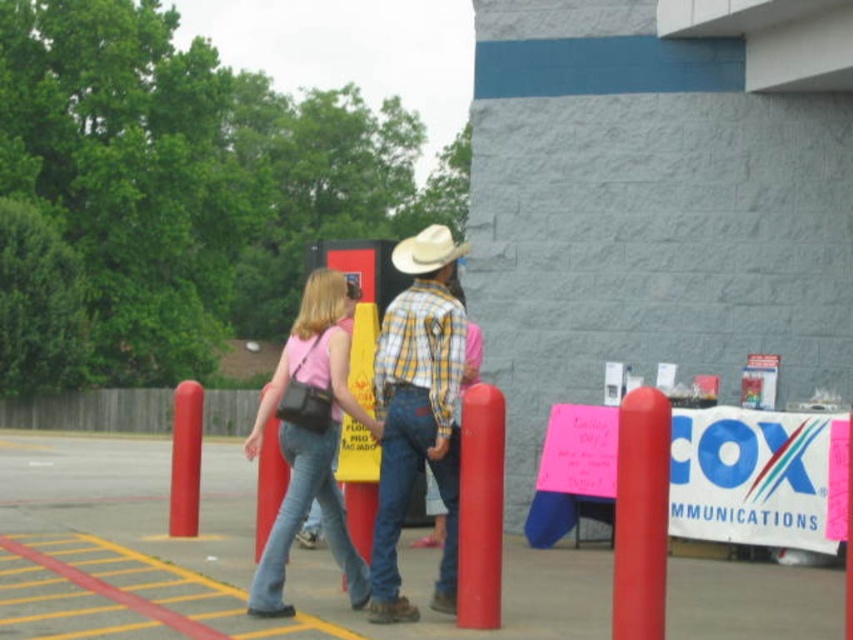
You are a delivery person trying to fit both the matte black bag at center and the light brown felt cowboy hat at center into a storage box that can only accommodate items up to the width of the wider object. Which object should you use as the reference for the box size?

The light brown felt cowboy hat at center is wider than the matte black bag at center, so the box should be sized to accommodate the width of the light brown felt cowboy hat at center.

You are standing at the point with coordinates (310, 444) in the parking lot scene. What object are you currently standing on?

The point at coordinates (310, 444) is on the pink fabric purse at center.